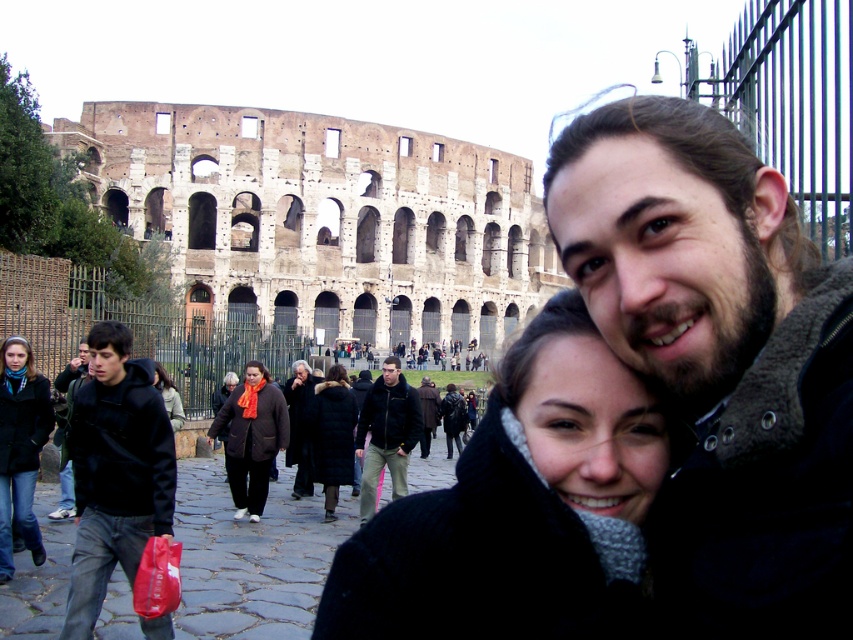
Question: Can you confirm if black fuzzy coat at center is positioned below denim jacket at lower left?

Choices:
 (A) no
 (B) yes

Answer: (B)

Question: Which object is closer to the camera taking this photo?

Choices:
 (A) black matte jacket at left
 (B) black fuzzy coat at center

Answer: (B)

Question: Can you confirm if dark brown hair at center is thinner than dark brown leather coat at center?

Choices:
 (A) yes
 (B) no

Answer: (B)

Question: Which point is closer to the camera?

Choices:
 (A) dark blue jeans at center
 (B) black fuzzy coat at center
 (C) black matte jacket at left
 (D) denim jacket at lower left

Answer: (B)

Question: Does black matte jacket at left appear on the right side of denim jacket at lower left?

Choices:
 (A) no
 (B) yes

Answer: (B)

Question: Which point appears closest to the camera in this image?

Choices:
 (A) (543, 467)
 (B) (126, 406)
 (C) (73, 372)

Answer: (A)